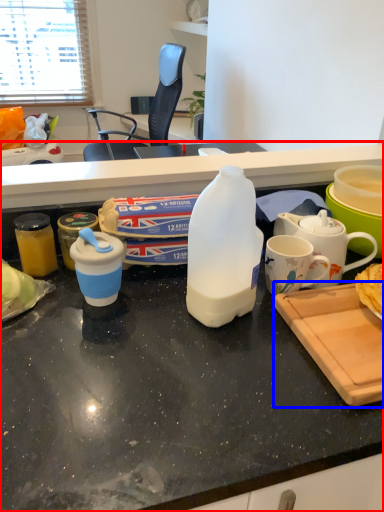
Question: Which point is further to the camera, desk (highlighted by a red box) or cutting board (highlighted by a blue box)?

Choices:
 (A) desk
 (B) cutting board

Answer: (B)